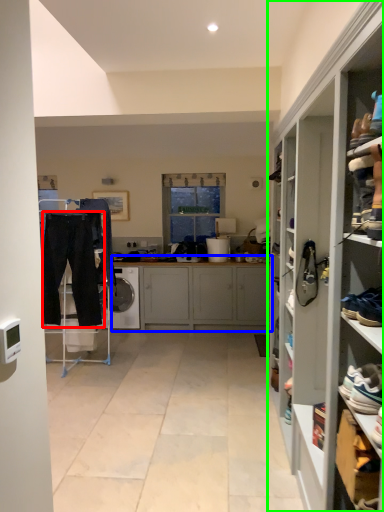
Question: Considering the real-world distances, which object is closest to trousers (highlighted by a red box)? cabinetry (highlighted by a blue box) or cupboard (highlighted by a green box).

Choices:
 (A) cabinetry
 (B) cupboard

Answer: (A)